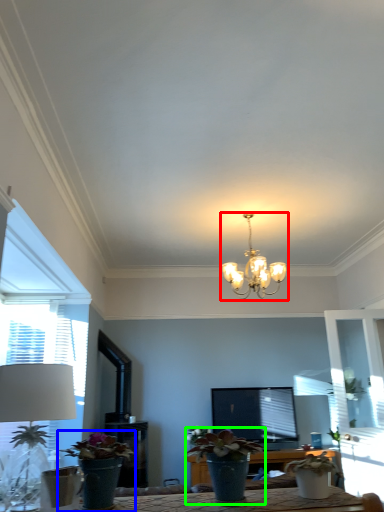
Question: Which object is positioned farthest from lamp (highlighted by a red box)? Select from houseplant (highlighted by a blue box) and houseplant (highlighted by a green box).

Choices:
 (A) houseplant
 (B) houseplant

Answer: (A)